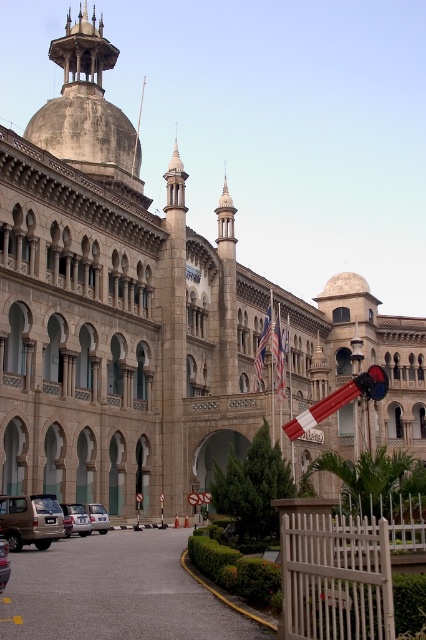
Question: Considering the real-world distances, which object is farthest from the blue fabric flag at center?

Choices:
 (A) gold metallic suv at center
 (B) silver metallic car at lower left
 (C) silver metallic car at center

Answer: (A)

Question: Is blue fabric flag at center positioned behind silver metallic car at center?

Choices:
 (A) yes
 (B) no

Answer: (A)

Question: Which point is farther to the camera?

Choices:
 (A) (284, 381)
 (B) (255, 381)
 (C) (6, 556)
 (D) (51, 540)

Answer: (B)

Question: Estimate the real-world distances between objects in this image. Which object is farther from the gold metallic suv at lower left?

Choices:
 (A) gold metallic suv at center
 (B) silver metallic car at center
 (C) american flag at center
 (D) stone dome at upper center

Answer: (D)

Question: Is gold metallic suv at lower left positioned in front of gold metallic suv at center?

Choices:
 (A) yes
 (B) no

Answer: (B)

Question: Can you confirm if blue fabric flag at center is thinner than gold metallic suv at center?

Choices:
 (A) no
 (B) yes

Answer: (A)